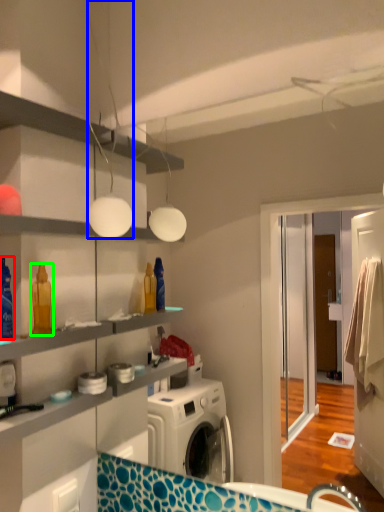
Question: Which object is positioned farthest from cleaning product (highlighted by a red box)? Select from light fixture (highlighted by a blue box) and cleaning product (highlighted by a green box).

Choices:
 (A) light fixture
 (B) cleaning product

Answer: (A)